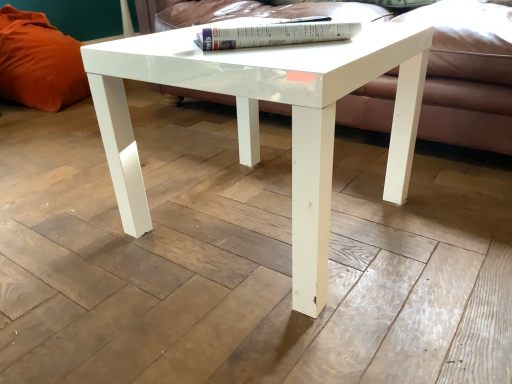
Where is `unoccupied area in front of white glossy coffee table at center`? The image size is (512, 384). unoccupied area in front of white glossy coffee table at center is located at coordinates (272, 323).